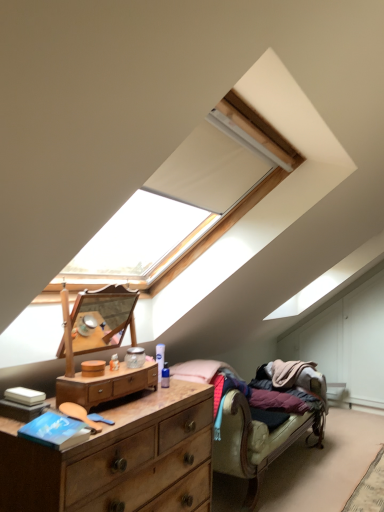
In the scene shown: What is the approximate height of wooden studio couch at lower right?

It is 32.32 inches.

Locate an element on the screen. This screenshot has height=512, width=384. wooden studio couch at lower right is located at coordinates (252, 443).

Does wooden studio couch at lower right appear on the right side of wooden dresser at lower left, which is counted as the second chest of drawers, starting from the top?

Yes, wooden studio couch at lower right is to the right of wooden dresser at lower left, which is counted as the second chest of drawers, starting from the top.

Which object is further away from the camera taking this photo, wooden studio couch at lower right or wooden dresser at lower left, which is counted as the second chest of drawers, starting from the top?

wooden studio couch at lower right is further from the camera.

Considering the positions of point (215, 467) and point (171, 399), is point (215, 467) closer or farther from the camera than point (171, 399)?

Clearly, point (215, 467) is more distant from the camera than point (171, 399).

The height and width of the screenshot is (512, 384). Find the location of `the 1st chest of drawers above the wooden studio couch at lower right (from the image's perspective)`. the 1st chest of drawers above the wooden studio couch at lower right (from the image's perspective) is located at coordinates (119, 459).

Which object is positioned more to the left, wooden dresser at lower left, acting as the first chest of drawers starting from the bottom, or wooden dresser at center, which is the second chest of drawers in bottom-to-top order?

wooden dresser at lower left, acting as the first chest of drawers starting from the bottom.

Considering the sizes of objects wooden dresser at lower left, which is counted as the second chest of drawers, starting from the top, and wooden dresser at center, which is the second chest of drawers in bottom-to-top order, in the image provided, who is taller, wooden dresser at lower left, which is counted as the second chest of drawers, starting from the top, or wooden dresser at center, which is the second chest of drawers in bottom-to-top order,?

With more height is wooden dresser at lower left, which is counted as the second chest of drawers, starting from the top.

From a real-world perspective, which object stands above the other?

From a 3D spatial view, wooden dresser at center, which is the second chest of drawers in bottom-to-top order, is above.

Would you consider wooden dresser at center, which is the second chest of drawers in bottom-to-top order, to be distant from wooden dresser at lower left, which is counted as the second chest of drawers, starting from the top?

No, wooden dresser at center, which is the second chest of drawers in bottom-to-top order, is not far from wooden dresser at lower left, which is counted as the second chest of drawers, starting from the top.

From a real-world perspective, is wooden dresser at center, which is the second chest of drawers in bottom-to-top order, positioned over wooden dresser at lower left, which is counted as the second chest of drawers, starting from the top, based on gravity?

Indeed, from a real-world perspective, wooden dresser at center, which is the second chest of drawers in bottom-to-top order, stands above wooden dresser at lower left, which is counted as the second chest of drawers, starting from the top.

Is wooden dresser at center, which is the second chest of drawers in bottom-to-top order, facing towards wooden dresser at lower left, which is counted as the second chest of drawers, starting from the top?

No, wooden dresser at center, which is the second chest of drawers in bottom-to-top order, is not aimed at wooden dresser at lower left, which is counted as the second chest of drawers, starting from the top.

Considering the sizes of wooden dresser at center, acting as the 1th chest of drawers starting from the top, and wooden dresser at lower left, acting as the first chest of drawers starting from the bottom, in the image, is wooden dresser at center, acting as the 1th chest of drawers starting from the top, taller or shorter than wooden dresser at lower left, acting as the first chest of drawers starting from the bottom,?

In the image, wooden dresser at center, acting as the 1th chest of drawers starting from the top, appears to be shorter than wooden dresser at lower left, acting as the first chest of drawers starting from the bottom.

Is wooden dresser at lower left, which is counted as the second chest of drawers, starting from the top, shorter than wooden studio couch at lower right?

Yes.

Looking at their sizes, would you say wooden dresser at lower left, acting as the first chest of drawers starting from the bottom, is wider or thinner than wooden studio couch at lower right?

In the image, wooden dresser at lower left, acting as the first chest of drawers starting from the bottom, appears to be more narrow than wooden studio couch at lower right.

Consider the image. From a real-world perspective, relative to wooden studio couch at lower right, is wooden dresser at lower left, which is counted as the second chest of drawers, starting from the top, vertically above or below?

wooden dresser at lower left, which is counted as the second chest of drawers, starting from the top, is situated higher than wooden studio couch at lower right in the real world.

Is wooden studio couch at lower right at the back of wooden dresser at lower left, which is counted as the second chest of drawers, starting from the top?

That's not correct — wooden dresser at lower left, which is counted as the second chest of drawers, starting from the top, is not looking away from wooden studio couch at lower right.

Could you tell me if wooden studio couch at lower right is turned towards wooden dresser at center, acting as the 1th chest of drawers starting from the top?

No, wooden studio couch at lower right is not oriented towards wooden dresser at center, acting as the 1th chest of drawers starting from the top.

Which object is thinner, wooden studio couch at lower right or wooden dresser at center, acting as the 1th chest of drawers starting from the top?

With smaller width is wooden dresser at center, acting as the 1th chest of drawers starting from the top.

Which object is positioned more to the left, wooden studio couch at lower right or wooden dresser at center, acting as the 1th chest of drawers starting from the top?

From the viewer's perspective, wooden dresser at center, acting as the 1th chest of drawers starting from the top, appears more on the left side.

Relative to wooden studio couch at lower right, is wooden dresser at center, which is the second chest of drawers in bottom-to-top order, in front or behind?

Visually, wooden dresser at center, which is the second chest of drawers in bottom-to-top order, is located in front of wooden studio couch at lower right.

Considering the sizes of objects wooden dresser at center, which is the second chest of drawers in bottom-to-top order, and wooden studio couch at lower right in the image provided, who is thinner, wooden dresser at center, which is the second chest of drawers in bottom-to-top order, or wooden studio couch at lower right?

With smaller width is wooden dresser at center, which is the second chest of drawers in bottom-to-top order.

Could you tell me if wooden dresser at center, which is the second chest of drawers in bottom-to-top order, is turned towards wooden studio couch at lower right?

No, wooden dresser at center, which is the second chest of drawers in bottom-to-top order, is not turned towards wooden studio couch at lower right.

Does point (145, 368) come behind point (216, 362)?

No, (145, 368) is in front of (216, 362).

In order to click on the 2nd chest of drawers counting from the left of the wooden studio couch at lower right in this screenshot , I will do `click(119, 459)`.

Locate an element on the screen. This screenshot has width=384, height=512. the chest of drawers located underneath the wooden dresser at center, which is the second chest of drawers in bottom-to-top order (from a real-world perspective) is located at coordinates (119, 459).

Looking at the image, which one is located closer to wooden studio couch at lower right, wooden dresser at lower left, acting as the first chest of drawers starting from the bottom, or wooden dresser at center, acting as the 1th chest of drawers starting from the top?

Based on the image, wooden dresser at lower left, acting as the first chest of drawers starting from the bottom, appears to be nearer to wooden studio couch at lower right.

Which object lies nearer to the anchor point wooden dresser at lower left, which is counted as the second chest of drawers, starting from the top, wooden dresser at center, acting as the 1th chest of drawers starting from the top, or wooden studio couch at lower right?

The object closer to wooden dresser at lower left, which is counted as the second chest of drawers, starting from the top, is wooden dresser at center, acting as the 1th chest of drawers starting from the top.

Based on their spatial positions, is wooden studio couch at lower right or wooden dresser at lower left, acting as the first chest of drawers starting from the bottom, further from wooden dresser at center, which is the second chest of drawers in bottom-to-top order?

Based on the image, wooden studio couch at lower right appears to be further to wooden dresser at center, which is the second chest of drawers in bottom-to-top order.

From the picture: Looking at the image, which one is located further to wooden dresser at center, which is the second chest of drawers in bottom-to-top order, wooden dresser at lower left, which is counted as the second chest of drawers, starting from the top, or wooden studio couch at lower right?

Based on the image, wooden studio couch at lower right appears to be further to wooden dresser at center, which is the second chest of drawers in bottom-to-top order.

Considering their positions, is wooden dresser at center, which is the second chest of drawers in bottom-to-top order, positioned further to wooden studio couch at lower right than wooden dresser at lower left, which is counted as the second chest of drawers, starting from the top?

wooden dresser at center, which is the second chest of drawers in bottom-to-top order, lies further to wooden studio couch at lower right than the other object.

From the image, which object appears to be farther from wooden dresser at lower left, acting as the first chest of drawers starting from the bottom, wooden studio couch at lower right or wooden dresser at center, acting as the 1th chest of drawers starting from the top?

wooden studio couch at lower right lies further to wooden dresser at lower left, acting as the first chest of drawers starting from the bottom, than the other object.

The image size is (384, 512). What are the coordinates of `chest of drawers between wooden dresser at lower left, acting as the first chest of drawers starting from the bottom, and wooden studio couch at lower right in the front-back direction` in the screenshot? It's located at (106, 385).